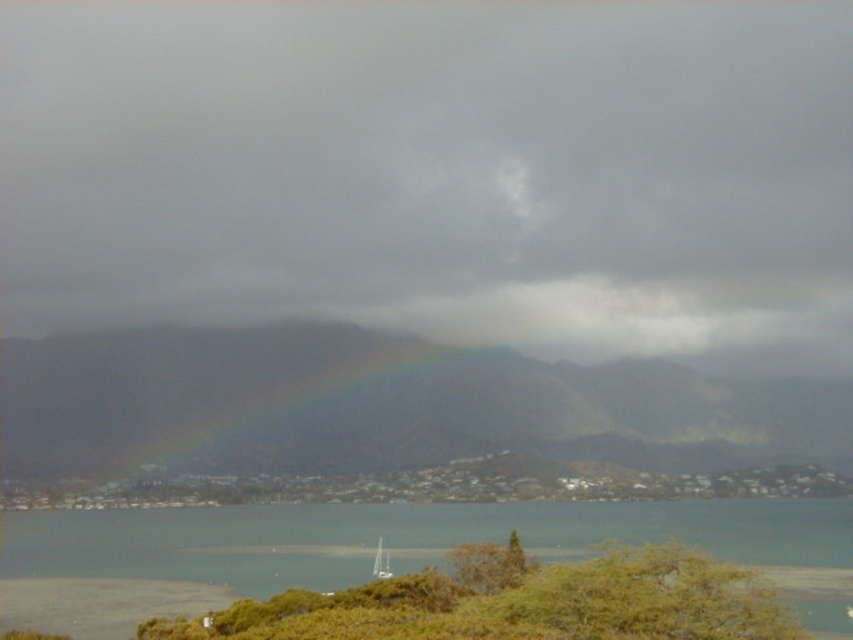
Can you confirm if rainbow at center is bigger than white sailboat at center?

Yes, rainbow at center is bigger than white sailboat at center.

Which is more to the left, rainbow at center or white sailboat at center?

Positioned to the left is white sailboat at center.

Who is more distant from viewer, (531, 296) or (381, 540)?

The point (531, 296) is more distant.

Identify the location of rainbow at center. (637, 317).

Can you confirm if clear water at lower center is positioned above rainbow at center?

Incorrect, clear water at lower center is not positioned above rainbow at center.

Looking at this image, who is positioned more to the left, clear water at lower center or rainbow at center?

Positioned to the left is clear water at lower center.

Image resolution: width=853 pixels, height=640 pixels. I want to click on clear water at lower center, so click(373, 552).

Locate an element on the screen. clear water at lower center is located at coordinates (373, 552).

Which is in front, point (134, 544) or point (376, 548)?

Positioned in front is point (376, 548).

Is clear water at lower center below white sailboat at center?

No, clear water at lower center is not below white sailboat at center.

The height and width of the screenshot is (640, 853). Describe the element at coordinates (373, 552) in the screenshot. I see `clear water at lower center` at that location.

Where is `clear water at lower center`? clear water at lower center is located at coordinates (373, 552).